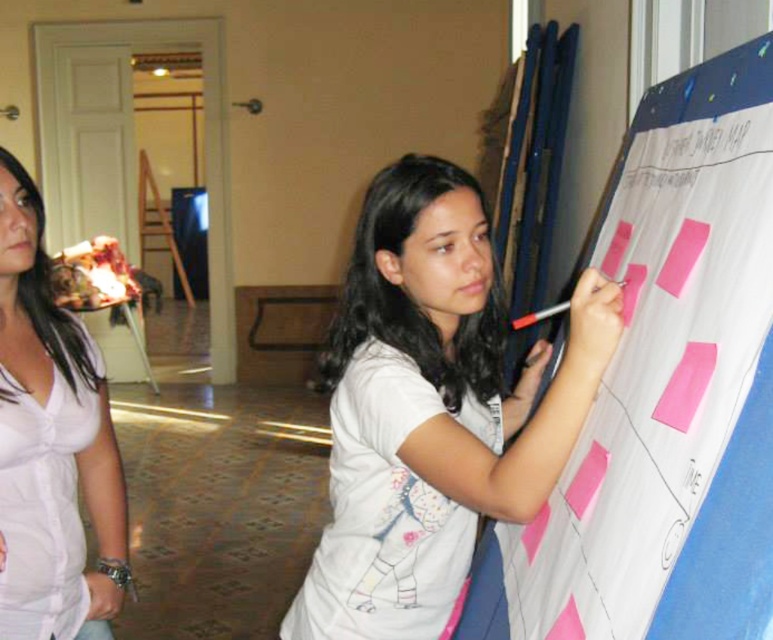
Question: Which point is farther to the camera?

Choices:
 (A) (577, 296)
 (B) (673, 557)
 (C) (53, 509)
 (D) (509, 324)

Answer: (D)

Question: Can you confirm if white cotton shirt at center is thinner than white plastic pen at upper right?

Choices:
 (A) yes
 (B) no

Answer: (B)

Question: Which point appears farthest from the camera in this image?

Choices:
 (A) (533, 321)
 (B) (594, 563)

Answer: (A)

Question: Is pink paper at right further to camera compared to white cotton shirt at center?

Choices:
 (A) no
 (B) yes

Answer: (A)

Question: Does white satin blouse at left have a greater width compared to white plastic pen at upper right?

Choices:
 (A) no
 (B) yes

Answer: (B)

Question: Which object appears closest to the camera in this image?

Choices:
 (A) white satin blouse at left
 (B) pink paper at right
 (C) white plastic pen at upper right

Answer: (B)